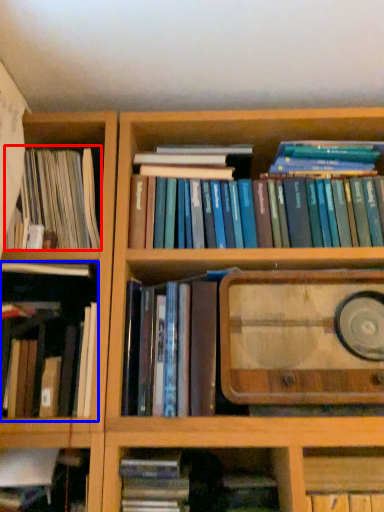
Question: Which object is further to the camera taking this photo, book (highlighted by a red box) or book (highlighted by a blue box)?

Choices:
 (A) book
 (B) book

Answer: (A)